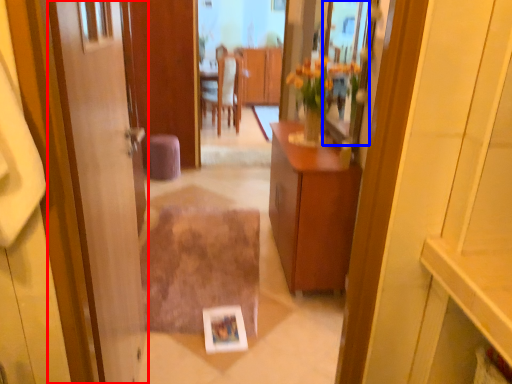
Question: Which of the following is the farthest to the observer, door (highlighted by a red box) or mirror (highlighted by a blue box)?

Choices:
 (A) door
 (B) mirror

Answer: (B)